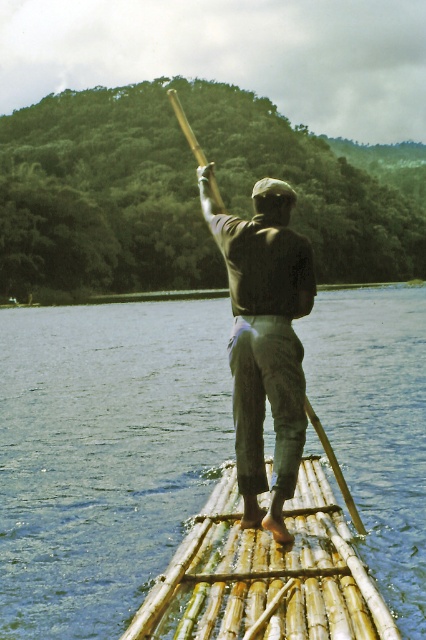
You are a photographer trying to capture the scene of the bamboo raft at center and the dark brown leather pants at center. Based on their positions, which object is closer to the water surface?

The bamboo raft at center is closer to the water surface because it is positioned below the dark brown leather pants at center.

You are a drone operator trying to capture a photo of the bamboo raft at center. According to the coordinates, where should you focus your camera?

You should focus your camera at point (x=265, y=576) to capture the bamboo raft at center.

You are a drone operator tasked with capturing aerial footage of the bamboo raft at center. The raft is located at point (265, 576). Your drone is currently at point 0.5, 0.5. In which direction should you move the drone to reach the bamboo raft at center?

The bamboo raft at center is located at point (265, 576). Since the drone is at 0.5, 0.5, you should move the drone northeast to reach the bamboo raft at center.